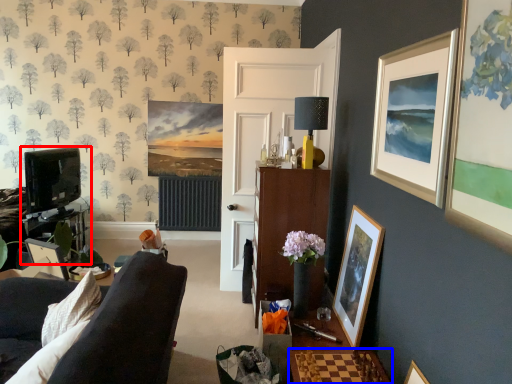
Question: Which point is further to the camera, entertainment center (highlighted by a red box) or table (highlighted by a blue box)?

Choices:
 (A) entertainment center
 (B) table

Answer: (A)